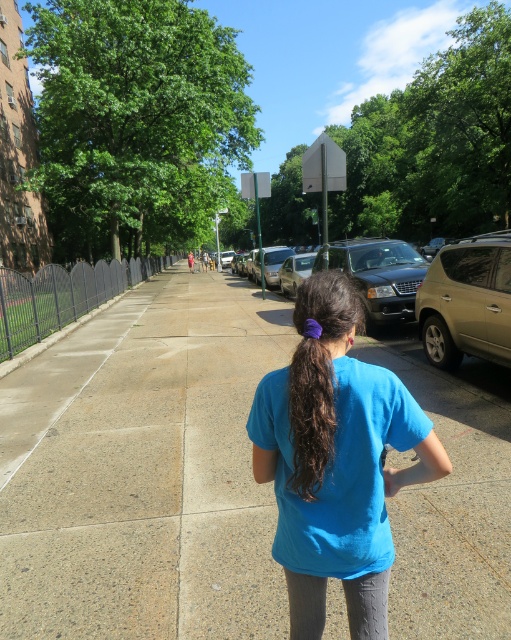
You are a delivery person trying to deliver a package to the building behind the gray concrete sidewalk at center and the shiny black sedan at center. The sidewalk is narrow, and the sedan is parked in the middle. Can you walk around the sedan to reach the building without moving the car?

The gray concrete sidewalk at center occupies less space than the shiny black sedan at center, so the sidewalk is too narrow to walk around the sedan. You will need to move the car or find another path.

You are a drone operator trying to capture a photo of the gray concrete sidewalk at center and the brown silky hair at center from above. According to the scene, can you see both objects clearly in the photo?

The gray concrete sidewalk at center is positioned under brown silky hair at center, so the brown silky hair at center will block the view of the gray concrete sidewalk at center from an overhead perspective, making it impossible to see both clearly in the photo.